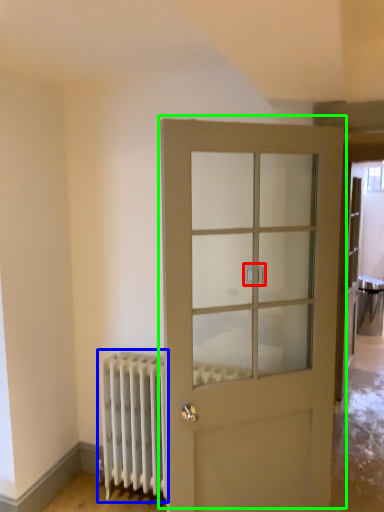
Question: Estimate the real-world distances between objects in this image. Which object is closer to door handle (highlighted by a red box), radiator (highlighted by a blue box) or door (highlighted by a green box)?

Choices:
 (A) radiator
 (B) door

Answer: (B)